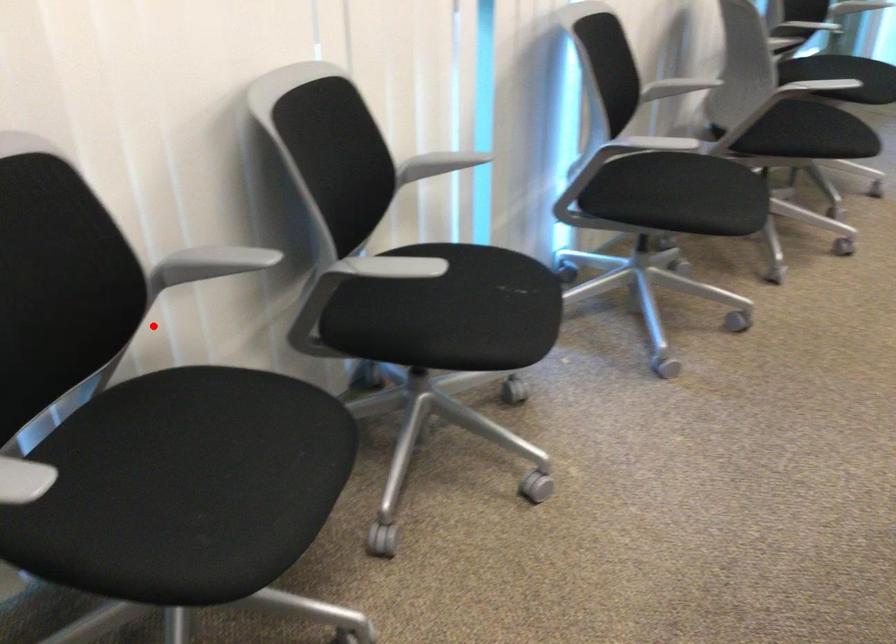
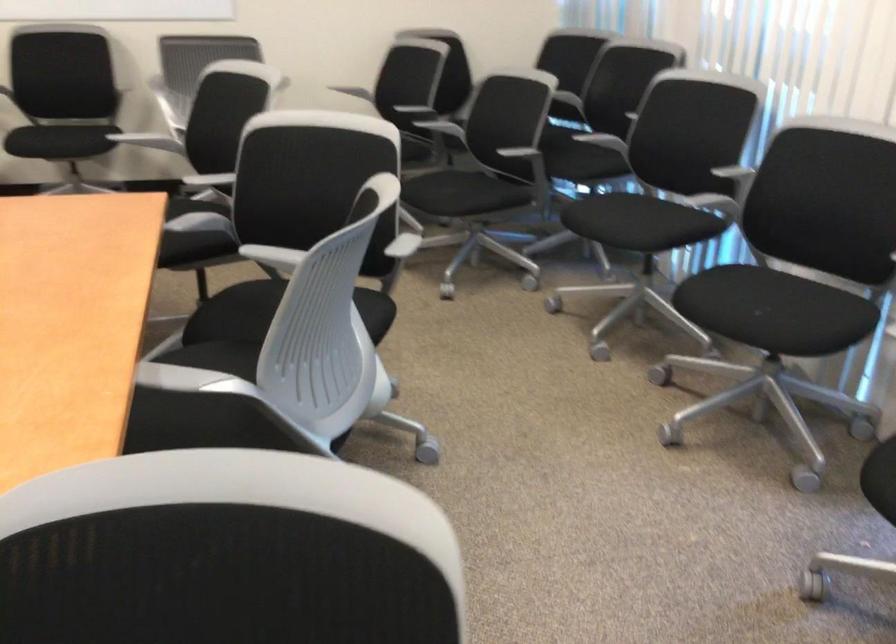
Question: I am providing you with two images of the same scene from different viewpoints. Given a red point in image1, look at the same physical point in image2. Is it:

Choices:
 (A) Closer to the viewpoint
 (B) Farther from the viewpoint

Answer: (B)